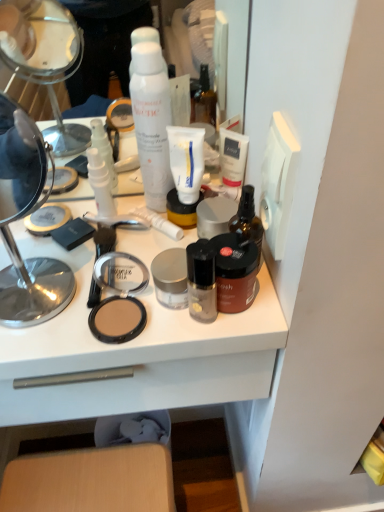
Locate an element on the screen. The image size is (384, 512). blank space to the left of matte brown compact at center is located at coordinates (49, 325).